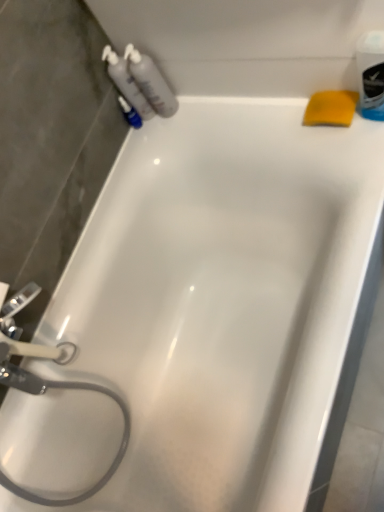
Find the location of a particular element. The height and width of the screenshot is (512, 384). free space in front of translucent plastic bottles at upper left, acting as the second cleaning product starting from the left is located at coordinates (213, 119).